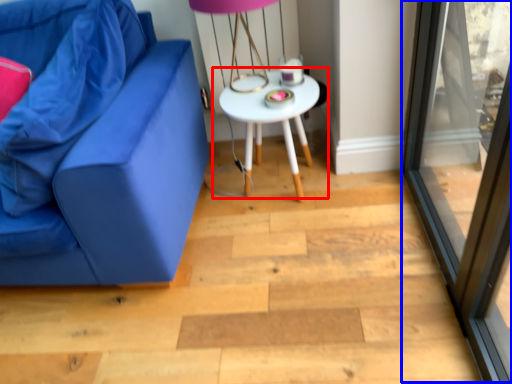
Question: Which object is closer to the camera taking this photo, table (highlighted by a red box) or screen door (highlighted by a blue box)?

Choices:
 (A) table
 (B) screen door

Answer: (B)